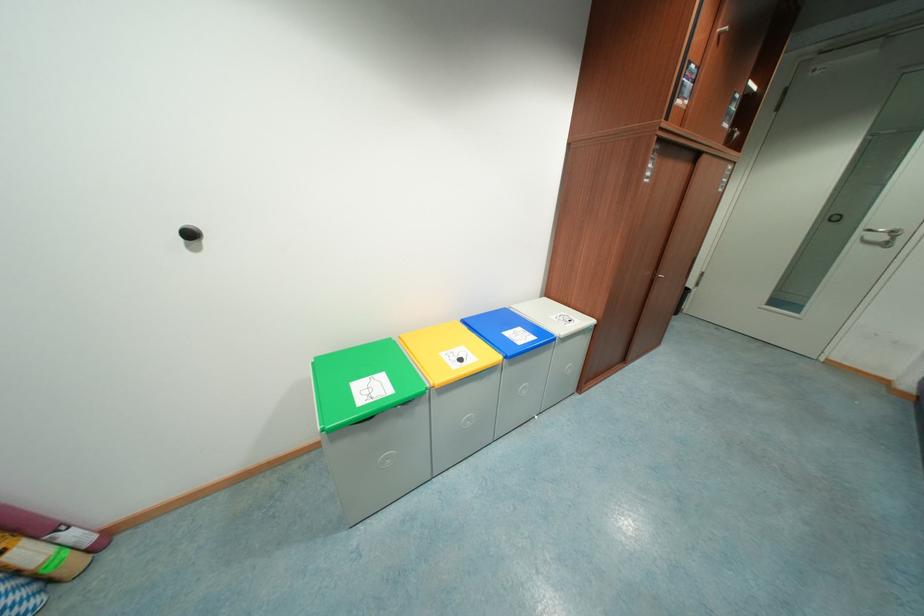
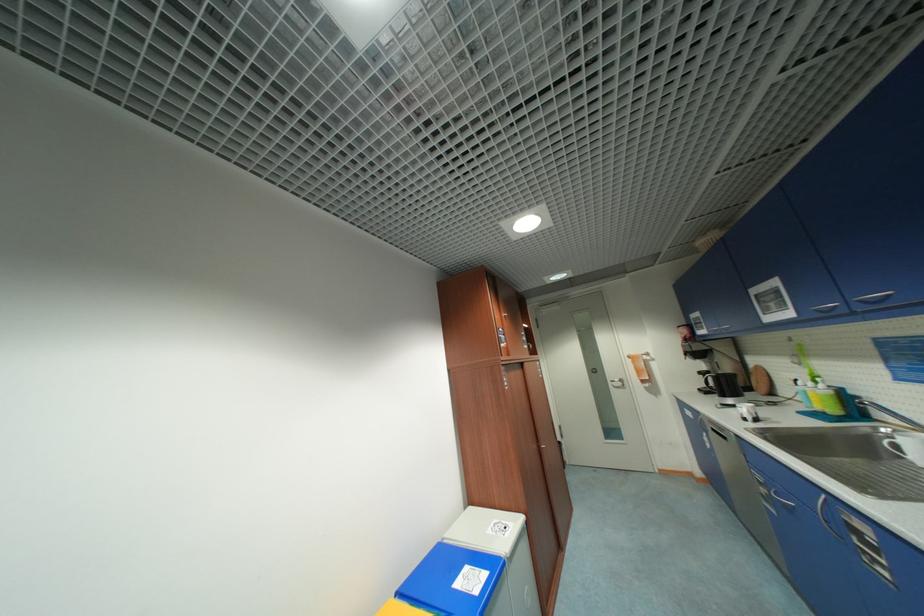
In the second image, find the point that corresponds to the point at 558,318 in the first image.

(495, 533)